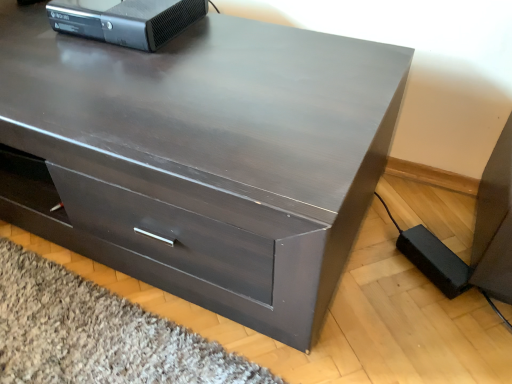
Where is `vacant area on top of matte dark wood chest of drawers at center (from a real-world perspective)`? vacant area on top of matte dark wood chest of drawers at center (from a real-world perspective) is located at coordinates (138, 61).